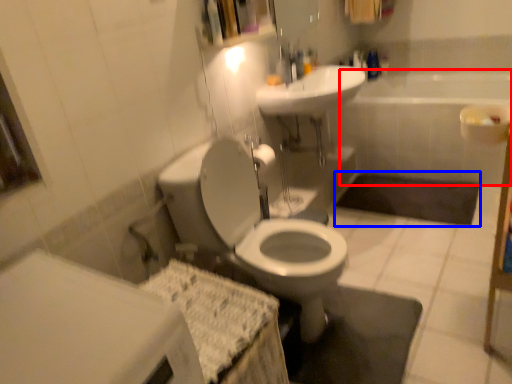
Question: Which of the following is the farthest to the observer, bath (highlighted by a red box) or bath mat (highlighted by a blue box)?

Choices:
 (A) bath
 (B) bath mat

Answer: (A)